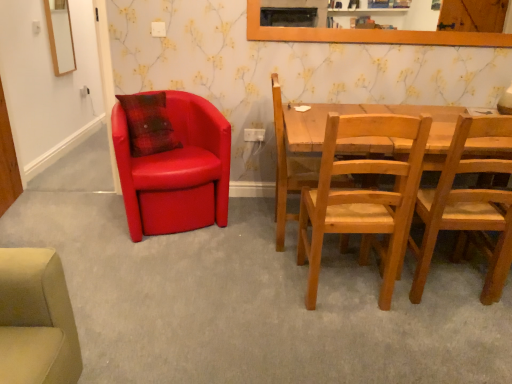
Question: From a real-world perspective, relative to white plastic power outlet at upper center, the second power outlet when ordered from bottom to top, is wooden-framed mirror at upper left vertically above or below?

Choices:
 (A) above
 (B) below

Answer: (B)

Question: Based on their positions, is wooden-framed mirror at upper left located to the left or right of white plastic power outlet at upper center, which appears as the second power outlet when viewed from the right?

Choices:
 (A) left
 (B) right

Answer: (A)

Question: Which is farther from the matte leather chair at left, the 4th chair from the right?

Choices:
 (A) white plastic power outlet at lower center, the first power outlet from the back
 (B) wooden-framed mirror at upper left
 (C) white plastic power outlet at upper center, which appears as the second power outlet when viewed from the right
 (D) wooden chair at center, arranged as the 2th chair when viewed from the left
 (E) natural wood chair at center, the 3th chair viewed from the left

Answer: (B)

Question: Based on their relative distances, which object is nearer to the natural wood chair at center, the 3th chair viewed from the left?

Choices:
 (A) matte leather chair at left, the 4th chair from the right
 (B) wooden-framed mirror at upper left
 (C) white plastic power outlet at lower center, placed as the second power outlet when sorted from front to back
 (D) light brown wooden chair at right, acting as the first chair starting from the right
 (E) white plastic power outlet at upper center, which is the second power outlet in back-to-front order

Answer: (D)